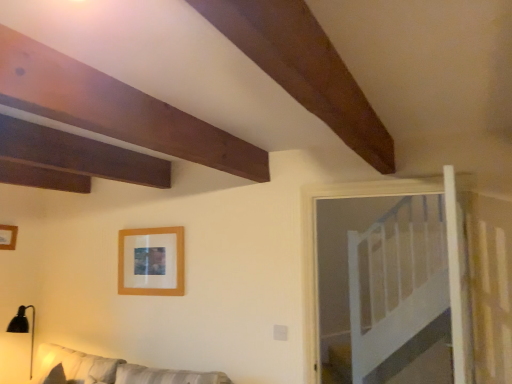
I want to click on black matte lamp at lower left, so click(x=24, y=328).

Where is `white wooden bed at upper right`? The image size is (512, 384). white wooden bed at upper right is located at coordinates (401, 296).

Where is `wooden frame at upper left, the second picture frame positioned from the right`? wooden frame at upper left, the second picture frame positioned from the right is located at coordinates (8, 237).

Which object is positioned more to the right, wooden frame at upper center, the 2th picture frame viewed from the left, or white fabric couch at lower left?

wooden frame at upper center, the 2th picture frame viewed from the left.

How many degrees apart are the facing directions of wooden frame at upper center, positioned as the first picture frame in right-to-left order, and white fabric couch at lower left?

The facing directions of wooden frame at upper center, positioned as the first picture frame in right-to-left order, and white fabric couch at lower left are 0.0701 degrees apart.

From a real-world perspective, is wooden frame at upper center, positioned as the first picture frame in right-to-left order, physically located above or below white fabric couch at lower left?

wooden frame at upper center, positioned as the first picture frame in right-to-left order, is situated higher than white fabric couch at lower left in the real world.

The width and height of the screenshot is (512, 384). I want to click on couch below the wooden frame at upper center, the 2th picture frame viewed from the left (from the image's perspective), so click(118, 369).

The image size is (512, 384). I want to click on picture frame that is in front of the wooden frame at upper left, arranged as the first picture frame when viewed from the left, so click(x=151, y=261).

Which is more to the left, wooden frame at upper left, the second picture frame positioned from the right, or wooden frame at upper center, positioned as the first picture frame in right-to-left order?

From the viewer's perspective, wooden frame at upper left, the second picture frame positioned from the right, appears more on the left side.

Which of these two, wooden frame at upper left, the second picture frame positioned from the right, or wooden frame at upper center, positioned as the first picture frame in right-to-left order, is smaller?

wooden frame at upper left, the second picture frame positioned from the right, is smaller.

In the scene shown: From a real-world perspective, which object stands above the other?

wooden frame at upper left, arranged as the first picture frame when viewed from the left, from a real-world perspective.

Considering the positions of objects white wooden bed at upper right and white fabric couch at lower left in the image provided, who is in front, white wooden bed at upper right or white fabric couch at lower left?

white fabric couch at lower left is more forward.

From their relative heights in the image, would you say white wooden bed at upper right is taller or shorter than white fabric couch at lower left?

Considering their sizes, white wooden bed at upper right has more height than white fabric couch at lower left.

Is white wooden bed at upper right touching white fabric couch at lower left?

No, white wooden bed at upper right is not next to white fabric couch at lower left.

Based on the photo, from a real-world perspective, is white wooden bed at upper right located higher than white fabric couch at lower left?

Indeed, from a real-world perspective, white wooden bed at upper right stands above white fabric couch at lower left.

Is wooden frame at upper center, positioned as the first picture frame in right-to-left order, bigger or smaller than wooden frame at upper left, arranged as the first picture frame when viewed from the left?

Considering their sizes, wooden frame at upper center, positioned as the first picture frame in right-to-left order, takes up more space than wooden frame at upper left, arranged as the first picture frame when viewed from the left.

Based on the photo, from the image's perspective, who appears lower, wooden frame at upper center, the 2th picture frame viewed from the left, or wooden frame at upper left, the second picture frame positioned from the right?

wooden frame at upper center, the 2th picture frame viewed from the left.

Is wooden frame at upper center, the 2th picture frame viewed from the left, facing away from wooden frame at upper left, the second picture frame positioned from the right?

No, wooden frame at upper left, the second picture frame positioned from the right, is not at the back of wooden frame at upper center, the 2th picture frame viewed from the left.

From a real-world perspective, between white wooden bed at upper right and black matte lamp at lower left, who is vertically lower?

black matte lamp at lower left.

Looking at this image, considering the sizes of objects white wooden bed at upper right and black matte lamp at lower left in the image provided, who is bigger, white wooden bed at upper right or black matte lamp at lower left?

With larger size is white wooden bed at upper right.

Is white wooden bed at upper right directly adjacent to black matte lamp at lower left?

No, white wooden bed at upper right is not touching black matte lamp at lower left.

Would you say black matte lamp at lower left is part of white wooden bed at upper right's contents?

Actually, black matte lamp at lower left is outside white wooden bed at upper right.

From the image's perspective, is black matte lamp at lower left beneath wooden frame at upper center, the 2th picture frame viewed from the left?

Correct, black matte lamp at lower left appears lower than wooden frame at upper center, the 2th picture frame viewed from the left, in the image.

Does black matte lamp at lower left contain wooden frame at upper center, the 2th picture frame viewed from the left?

Definitely not — wooden frame at upper center, the 2th picture frame viewed from the left, is not inside black matte lamp at lower left.

Is black matte lamp at lower left turned away from wooden frame at upper center, positioned as the first picture frame in right-to-left order?

That's not correct — black matte lamp at lower left is not looking away from wooden frame at upper center, positioned as the first picture frame in right-to-left order.

In the image, is white fabric couch at lower left on the left side or the right side of white wooden bed at upper right?

From the image, it's evident that white fabric couch at lower left is to the left of white wooden bed at upper right.

Is white fabric couch at lower left in front of white wooden bed at upper right?

Yes, white fabric couch at lower left is closer to the viewer.

Can you tell me how much white fabric couch at lower left and white wooden bed at upper right differ in facing direction?

They differ by 0.199 degrees in their facing directions.

Image resolution: width=512 pixels, height=384 pixels. In order to click on picture frame that is the 1st one when counting upward from the white fabric couch at lower left (from the image's perspective) in this screenshot , I will do `click(151, 261)`.

You are a GUI agent. You are given a task and a screenshot of the screen. Output one action in this format:
    pyautogui.click(x=<x>, y=<y>)
    Task: Click on the picture frame below the wooden frame at upper left, the second picture frame positioned from the right (from the image's perspective)
    
    Given the screenshot: What is the action you would take?
    pyautogui.click(x=151, y=261)

Based on their spatial positions, is wooden frame at upper center, positioned as the first picture frame in right-to-left order, or white fabric couch at lower left closer to wooden frame at upper left, arranged as the first picture frame when viewed from the left?

Based on the image, white fabric couch at lower left appears to be nearer to wooden frame at upper left, arranged as the first picture frame when viewed from the left.

Estimate the real-world distances between objects in this image. Which object is further from white fabric couch at lower left, wooden frame at upper left, arranged as the first picture frame when viewed from the left, or black matte lamp at lower left?

wooden frame at upper left, arranged as the first picture frame when viewed from the left.

Based on the photo, considering their positions, is wooden frame at upper center, positioned as the first picture frame in right-to-left order, positioned further to white wooden bed at upper right than wooden frame at upper left, the second picture frame positioned from the right?

Among the two, wooden frame at upper left, the second picture frame positioned from the right, is located further to white wooden bed at upper right.

Consider the image. Looking at the image, which one is located further to wooden frame at upper center, positioned as the first picture frame in right-to-left order, black matte lamp at lower left or wooden frame at upper left, arranged as the first picture frame when viewed from the left?

wooden frame at upper left, arranged as the first picture frame when viewed from the left, is positioned further to the anchor wooden frame at upper center, positioned as the first picture frame in right-to-left order.

Estimate the real-world distances between objects in this image. Which object is further from wooden frame at upper left, the second picture frame positioned from the right, white fabric couch at lower left or white wooden bed at upper right?

Among the two, white wooden bed at upper right is located further to wooden frame at upper left, the second picture frame positioned from the right.

From the image, which object appears to be nearer to wooden frame at upper center, positioned as the first picture frame in right-to-left order, white fabric couch at lower left or black matte lamp at lower left?

Among the two, white fabric couch at lower left is located nearer to wooden frame at upper center, positioned as the first picture frame in right-to-left order.

Based on their spatial positions, is black matte lamp at lower left or wooden frame at upper center, positioned as the first picture frame in right-to-left order, closer to white fabric couch at lower left?

wooden frame at upper center, positioned as the first picture frame in right-to-left order.

When comparing their distances from white wooden bed at upper right, does wooden frame at upper left, arranged as the first picture frame when viewed from the left, or white fabric couch at lower left seem closer?

white fabric couch at lower left lies closer to white wooden bed at upper right than the other object.

The image size is (512, 384). In order to click on lamp between wooden frame at upper left, arranged as the first picture frame when viewed from the left, and white wooden bed at upper right from left to right in this screenshot , I will do `click(24, 328)`.

This screenshot has width=512, height=384. In order to click on picture frame between white fabric couch at lower left and wooden frame at upper left, arranged as the first picture frame when viewed from the left, from front to back in this screenshot , I will do point(151,261).

Find the location of a particular element. picture frame situated between black matte lamp at lower left and white wooden bed at upper right from left to right is located at coordinates (151, 261).

Find the location of a particular element. This screenshot has height=384, width=512. couch between black matte lamp at lower left and white wooden bed at upper right is located at coordinates (118, 369).